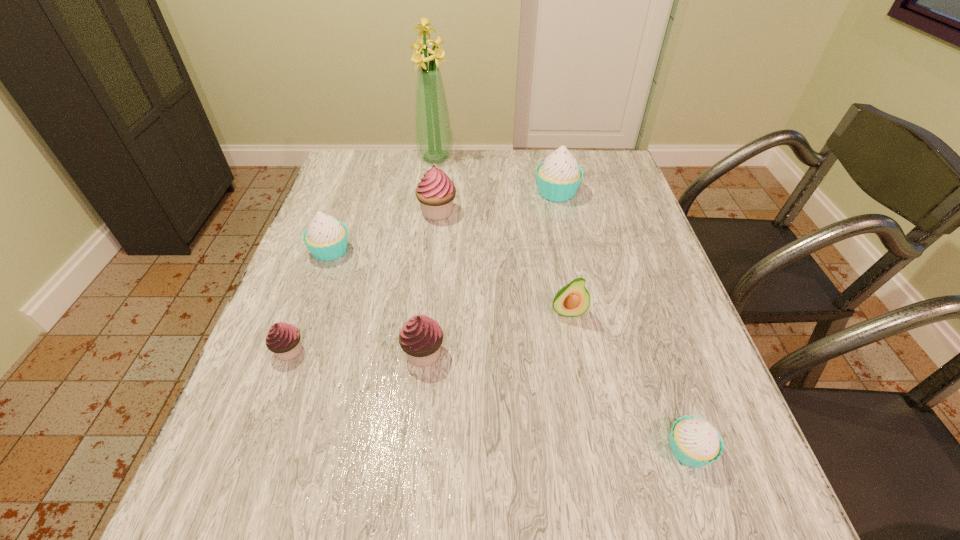
Image resolution: width=960 pixels, height=540 pixels. In order to click on object that stands as the seventh closest to the biggest white cupcake in this screenshot , I will do `click(283, 339)`.

At what (x,y) coordinates should I click in order to perform the action: click on the fifth closest object to the second smallest white cupcake. Please return your answer as a coordinate pair (x, y). The height and width of the screenshot is (540, 960). Looking at the image, I should click on (573, 300).

At what (x,y) coordinates should I click in order to perform the action: click on the fourth closest cupcake relative to the bouquet. Please return your answer as a coordinate pair (x, y). Image resolution: width=960 pixels, height=540 pixels. Looking at the image, I should click on [421, 337].

Locate an element on the screen. The image size is (960, 540). cupcake that is the second nearest to the biggest white cupcake is located at coordinates (326, 238).

Locate which white cupcake ranks second in proximity to the nearest object. Please provide its 2D coordinates. Your answer should be formatted as a tuple, i.e. [(x, y)], where the tuple contains the x and y coordinates of a point satisfying the conditions above.

[(326, 238)]

This screenshot has height=540, width=960. In order to click on white cupcake that stands as the closest to the leftmost pink cupcake in this screenshot , I will do `click(326, 238)`.

Choose which pink cupcake is the nearest neighbor to the biggest pink cupcake. Please provide its 2D coordinates. Your answer should be formatted as a tuple, i.e. [(x, y)], where the tuple contains the x and y coordinates of a point satisfying the conditions above.

[(421, 337)]

Identify which pink cupcake is the nearest to the second white cupcake from right to left. Please provide its 2D coordinates. Your answer should be formatted as a tuple, i.e. [(x, y)], where the tuple contains the x and y coordinates of a point satisfying the conditions above.

[(436, 191)]

Locate an element on the screen. free point that satisfies the following two spatial constraints: 1. on the front-facing side of the second smallest pink cupcake; 2. on the right side of the bouquet is located at coordinates (409, 353).